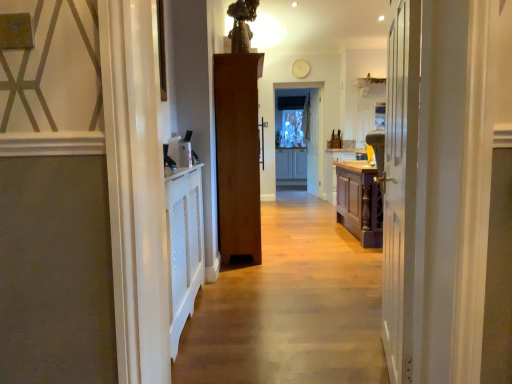
Image resolution: width=512 pixels, height=384 pixels. I want to click on vacant area that is in front of brown wooden door at center, which is the 2th door from back to front, so click(x=268, y=274).